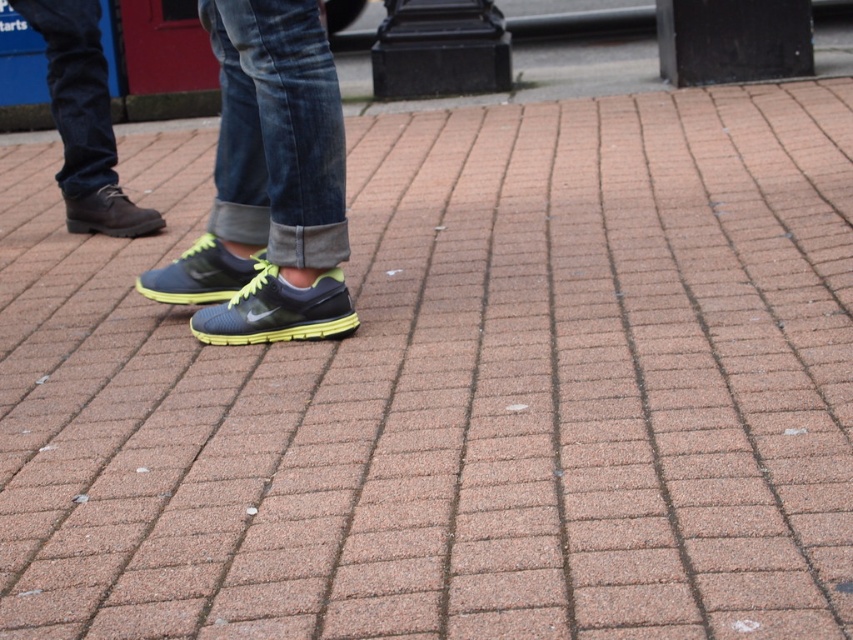
Consider the image. Does matte leather shoe at left have a lesser width compared to matte blue running shoe at center?

No.

Does point (77, 64) lie in front of point (148, 294)?

No, (77, 64) is further to viewer.

Does point (103, 225) lie in front of point (210, 296)?

That is False.

Identify the location of matte leather shoe at left. (84, 120).

Is matte leather shoe at left positioned before matte brown boot at left?

Yes.

Is matte leather shoe at left wider than matte brown boot at left?

A: Yes.

Is point (42, 13) positioned before point (103, 198)?

Yes, it is in front of point (103, 198).

Identify the location of matte leather shoe at left. (84, 120).

Looking at this image, between matte black sneakers at center and matte brown boot at left, which one is positioned lower?

Positioned lower is matte brown boot at left.

Is matte black sneakers at center taller than matte brown boot at left?

Correct, matte black sneakers at center is much taller as matte brown boot at left.

Between point (236, 104) and point (108, 227), which one is positioned in front?

Point (236, 104)

The height and width of the screenshot is (640, 853). Identify the location of matte black sneakers at center. (270, 184).